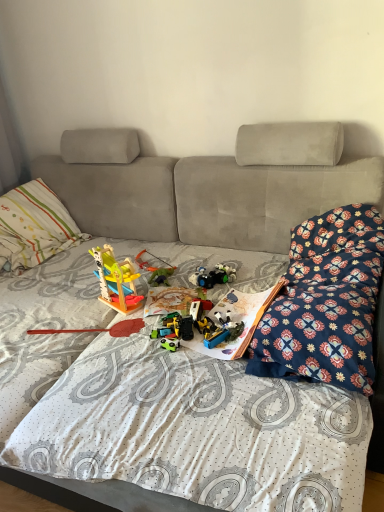
Identify the location of wooden toy at center. This screenshot has width=384, height=512. (99, 329).

Find the location of a particular element. The image size is (384, 512). paperboard book at center is located at coordinates (237, 321).

Based on the photo, is wooden toy at center, the 5th toy when ordered from front to back, smaller than wooden toy at center?

Indeed, wooden toy at center, the 5th toy when ordered from front to back, has a smaller size compared to wooden toy at center.

Is wooden toy at center, the 5th toy when ordered from front to back, further to camera compared to wooden toy at center?

Yes, the depth of wooden toy at center, the 5th toy when ordered from front to back, is greater than that of wooden toy at center.

Is wooden toy at center, the 5th toy when ordered from front to back, oriented towards wooden toy at center?

Yes, wooden toy at center, the 5th toy when ordered from front to back, is turned towards wooden toy at center.

Can you tell me how much wooden toy at center, the 5th toy when ordered from front to back, and wooden toy at center differ in facing direction?

The angle between the facing direction of wooden toy at center, the 5th toy when ordered from front to back, and the facing direction of wooden toy at center is 48.8 degrees.

Would you say multicolored plastic toy at center, marked as the 3th toy in a back-to-front arrangement, is outside paperboard book at center?

multicolored plastic toy at center, marked as the 3th toy in a back-to-front arrangement, is positioned outside paperboard book at center.

The height and width of the screenshot is (512, 384). What are the coordinates of `book on the right of multicolored plastic toy at center, marked as the 3th toy in a back-to-front arrangement` in the screenshot? It's located at (237, 321).

Can you confirm if multicolored plastic toy at center, the third toy when ordered from front to back, is positioned to the left of paperboard book at center?

Correct, you'll find multicolored plastic toy at center, the third toy when ordered from front to back, to the left of paperboard book at center.

Considering the sizes of objects multicolored plastic toy at center, marked as the 3th toy in a back-to-front arrangement, and paperboard book at center in the image provided, who is wider, multicolored plastic toy at center, marked as the 3th toy in a back-to-front arrangement, or paperboard book at center?

With larger width is paperboard book at center.

From a real-world perspective, is wooden toy at center, the 5th toy when ordered from front to back, located beneath wooden toy at center, which is counted as the 2th toy, starting from the front?

Yes, from a real-world perspective, wooden toy at center, the 5th toy when ordered from front to back, is under wooden toy at center, which is counted as the 2th toy, starting from the front.

From the image's perspective, would you say wooden toy at center, the first toy from the back, is shown under wooden toy at center, which is counted as the 2th toy, starting from the front?

No, from the image's perspective, wooden toy at center, the first toy from the back, is not below wooden toy at center, which is counted as the 2th toy, starting from the front.

Does floral-patterned fabric at right have a lesser height compared to plastic green toy at center, marked as the 4th toy in a front-to-back arrangement?

Incorrect, the height of floral-patterned fabric at right does not fall short of that of plastic green toy at center, marked as the 4th toy in a front-to-back arrangement.

Which object is more forward, floral-patterned fabric at right or plastic green toy at center, marked as the 4th toy in a front-to-back arrangement?

floral-patterned fabric at right is closer to the camera.

Is floral-patterned fabric at right oriented away from plastic green toy at center, which is counted as the second toy, starting from the back?

No, floral-patterned fabric at right is not facing the opposite direction of plastic green toy at center, which is counted as the second toy, starting from the back.

Is floral-patterned fabric at right not within plastic green toy at center, which is counted as the second toy, starting from the back?

Yes.

Is point (244, 315) closer to camera compared to point (159, 271)?

Yes, point (244, 315) is in front of point (159, 271).

Is paperboard book at center not within plastic green toy at center, which is counted as the second toy, starting from the back?

Yes, paperboard book at center is located beyond the bounds of plastic green toy at center, which is counted as the second toy, starting from the back.

From a real-world perspective, is paperboard book at center located beneath plastic green toy at center, which is counted as the second toy, starting from the back?

No, from a real-world perspective, paperboard book at center is not beneath plastic green toy at center, which is counted as the second toy, starting from the back.

From the picture: Is striped cotton pillow at left facing towards plastic green toy at center, which is counted as the second toy, starting from the back?

Yes, striped cotton pillow at left is oriented towards plastic green toy at center, which is counted as the second toy, starting from the back.

Considering the relative positions of striped cotton pillow at left and plastic green toy at center, which is counted as the second toy, starting from the back, in the image provided, is striped cotton pillow at left to the right of plastic green toy at center, which is counted as the second toy, starting from the back, from the viewer's perspective?

No, striped cotton pillow at left is not to the right of plastic green toy at center, which is counted as the second toy, starting from the back.

In the scene shown: Does striped cotton pillow at left have a greater height compared to plastic green toy at center, which is counted as the second toy, starting from the back?

Correct, striped cotton pillow at left is much taller as plastic green toy at center, which is counted as the second toy, starting from the back.

From the striped cotton pillow at left, count 1st toys backward and point to it. Please provide its 2D coordinates.

[(160, 276)]

Is multicolored plastic toy at center, marked as the 3th toy in a back-to-front arrangement, positioned beyond the bounds of wooden toy at center, which is counted as the 2th toy, starting from the front?

Yes, multicolored plastic toy at center, marked as the 3th toy in a back-to-front arrangement, is outside of wooden toy at center, which is counted as the 2th toy, starting from the front.

In terms of size, does multicolored plastic toy at center, marked as the 3th toy in a back-to-front arrangement, appear bigger or smaller than wooden toy at center, which is counted as the 4th toy, starting from the back?

multicolored plastic toy at center, marked as the 3th toy in a back-to-front arrangement, is smaller than wooden toy at center, which is counted as the 4th toy, starting from the back.

From a real-world perspective, is multicolored plastic toy at center, marked as the 3th toy in a back-to-front arrangement, physically located above or below wooden toy at center, which is counted as the 4th toy, starting from the back?

multicolored plastic toy at center, marked as the 3th toy in a back-to-front arrangement, is situated lower than wooden toy at center, which is counted as the 4th toy, starting from the back, in the real world.

Would you consider multicolored plastic toy at center, the third toy when ordered from front to back, to be distant from wooden toy at center, which is counted as the 4th toy, starting from the back?

No, multicolored plastic toy at center, the third toy when ordered from front to back, is in close proximity to wooden toy at center, which is counted as the 4th toy, starting from the back.

The width and height of the screenshot is (384, 512). Find the location of `the 3rd toy behind when counting from the wooden toy at center`. the 3rd toy behind when counting from the wooden toy at center is located at coordinates (155, 269).

At what (x,y) coordinates should I click in order to perform the action: click on book located on the right of multicolored plastic toy at center, the third toy when ordered from front to back. Please return your answer as a coordinate pair (x, y). The width and height of the screenshot is (384, 512). Looking at the image, I should click on (237, 321).

Considering their positions, is green plastic toy at center, which ranks as the 1th toy in front-to-back order, positioned further to wooden toy at center than wooden toy at center, the first toy from the back?

wooden toy at center, the first toy from the back.

Based on their spatial positions, is paperboard book at center or floral-patterned fabric at right closer to wooden toy at center, the 5th toy when ordered from front to back?

Among the two, paperboard book at center is located nearer to wooden toy at center, the 5th toy when ordered from front to back.

Considering their positions, is floral-patterned fabric at right positioned closer to striped cotton pillow at left than green plastic toy at center, the fifth toy positioned from the back?

green plastic toy at center, the fifth toy positioned from the back, is positioned closer to the anchor striped cotton pillow at left.

From the image, which object appears to be nearer to green plastic toy at center, which ranks as the 1th toy in front-to-back order, wooden toy at center or wooden toy at center, the first toy from the back?

wooden toy at center is positioned closer to the anchor green plastic toy at center, which ranks as the 1th toy in front-to-back order.

Which object lies further to the anchor point floral-patterned fabric at right, striped cotton pillow at left or plastic green toy at center, which is counted as the second toy, starting from the back?

striped cotton pillow at left is further to floral-patterned fabric at right.

From the picture: Based on their spatial positions, is striped cotton pillow at left or green plastic toy at center, which ranks as the 1th toy in front-to-back order, further from paperboard book at center?

The object further to paperboard book at center is striped cotton pillow at left.

Estimate the real-world distances between objects in this image. Which object is further from green plastic toy at center, the fifth toy positioned from the back, floral-patterned fabric at right or paperboard book at center?

floral-patterned fabric at right is positioned further to the anchor green plastic toy at center, the fifth toy positioned from the back.

From the picture: Looking at the image, which one is located further to green plastic toy at center, which ranks as the 1th toy in front-to-back order, striped cotton pillow at left or paperboard book at center?

striped cotton pillow at left lies further to green plastic toy at center, which ranks as the 1th toy in front-to-back order, than the other object.

Find the location of `twin located between striped cotton pillow at left and floral-patterned fabric at right in the left-right direction`. twin located between striped cotton pillow at left and floral-patterned fabric at right in the left-right direction is located at coordinates tap(99, 329).

Locate an element on the screen. Image resolution: width=384 pixels, height=512 pixels. toy between striped cotton pillow at left and wooden toy at center, the first toy from the back is located at coordinates (116, 280).

This screenshot has height=512, width=384. Identify the location of twin between wooden toy at center, which is counted as the 2th toy, starting from the front, and plastic green toy at center, which is counted as the second toy, starting from the back, in the front-back direction. click(99, 329).

This screenshot has width=384, height=512. What are the coordinates of `book between floral-patterned fabric at right and plastic green toy at center, which is counted as the second toy, starting from the back, in the front-back direction` in the screenshot? It's located at (237, 321).